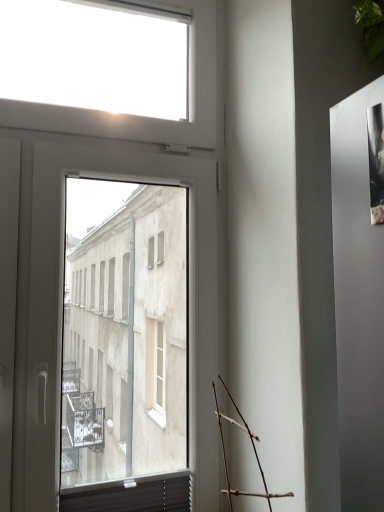
Where is `brown wood branch at lower right`? brown wood branch at lower right is located at coordinates (253, 449).

What do you see at coordinates (253, 449) in the screenshot?
I see `brown wood branch at lower right` at bounding box center [253, 449].

Locate an element on the screen. This screenshot has width=384, height=512. brown wood branch at lower right is located at coordinates (253, 449).